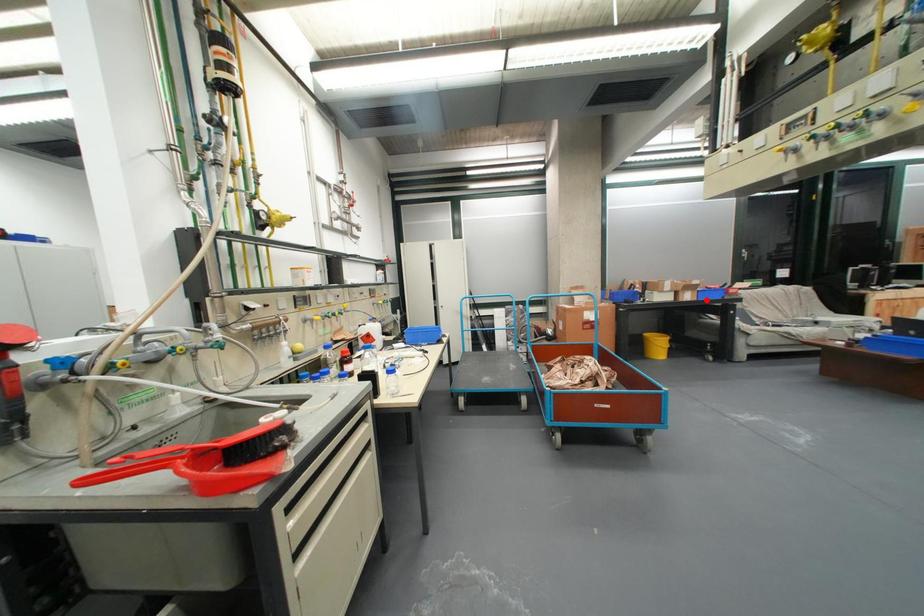
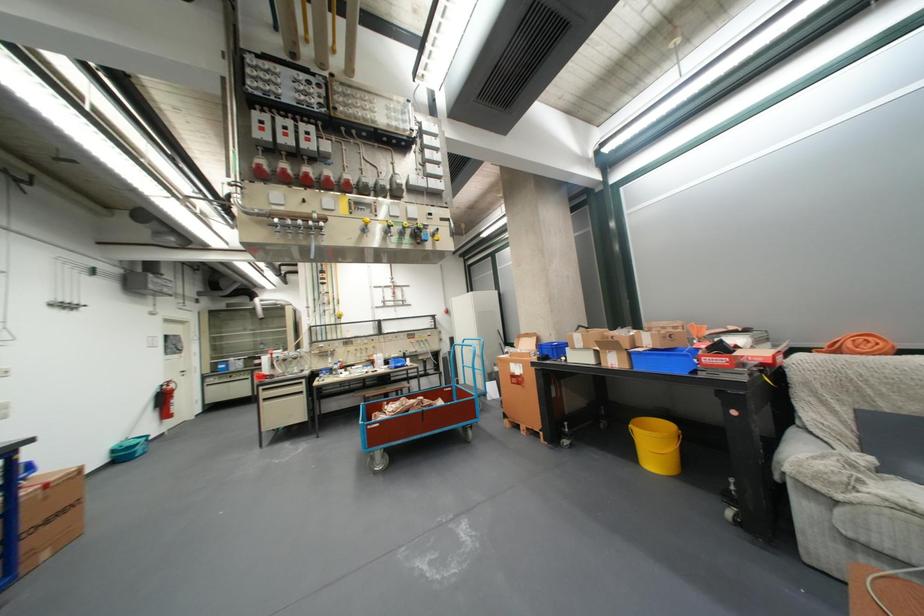
Where in the second image is the point corresponding to the highlighted location from the first image?

(638, 368)